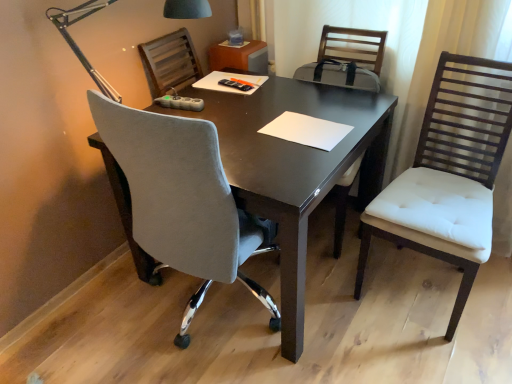
Locate an element on the screen. The image size is (512, 384). vacant space that's between velvet grey chair at center, which ranks as the 1th chair in left-to-right order, and white tufted cushion chair at right, acting as the 1th chair starting from the right is located at coordinates (369, 328).